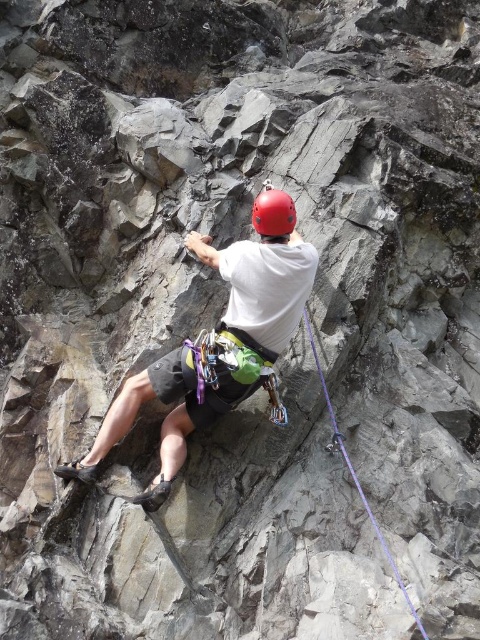
Question: Estimate the real-world distances between objects in this image. Which object is farther from the matte white helmet at center?

Choices:
 (A) purple synthetic rope at center
 (B) matte red helmet at center

Answer: (A)

Question: Which point is closer to the camera?

Choices:
 (A) (324, 376)
 (B) (284, 234)

Answer: (B)

Question: In this image, where is purple synthetic rope at center located relative to matte red helmet at center?

Choices:
 (A) below
 (B) above

Answer: (A)

Question: Is purple synthetic rope at center to the right of matte red helmet at center from the viewer's perspective?

Choices:
 (A) yes
 (B) no

Answer: (A)

Question: Considering the real-world distances, which object is closest to the matte white helmet at center?

Choices:
 (A) purple synthetic rope at center
 (B) matte red helmet at center

Answer: (B)

Question: Can you confirm if purple synthetic rope at center is positioned above matte red helmet at center?

Choices:
 (A) yes
 (B) no

Answer: (B)